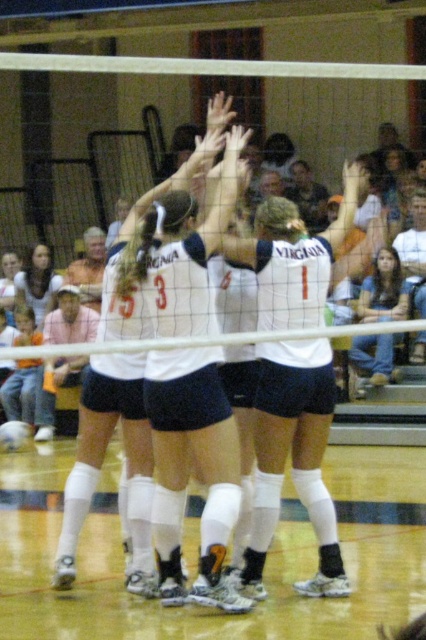
Question: Which object is the closest to the white matte jersey at center?

Choices:
 (A) white socks at center
 (B) denim jeans at lower right
 (C) matte black hair at lower left

Answer: (A)

Question: Based on their relative distances, which object is nearer to the white textured volleyball at center?

Choices:
 (A) white socks at center
 (B) matte black hair at lower left
 (C) white matte volleyball net at center

Answer: (B)

Question: Is white matte jersey at center closer to camera compared to matte black hair at lower left?

Choices:
 (A) yes
 (B) no

Answer: (A)

Question: Is the position of white matte volleyball net at center more distant than that of white matte jersey at center?

Choices:
 (A) no
 (B) yes

Answer: (A)

Question: Which object is farther from the camera taking this photo?

Choices:
 (A) white matte volleyball net at center
 (B) matte black hair at lower left
 (C) white matte jersey at center

Answer: (B)

Question: Does white matte jersey at center lie behind matte black hair at lower left?

Choices:
 (A) no
 (B) yes

Answer: (A)